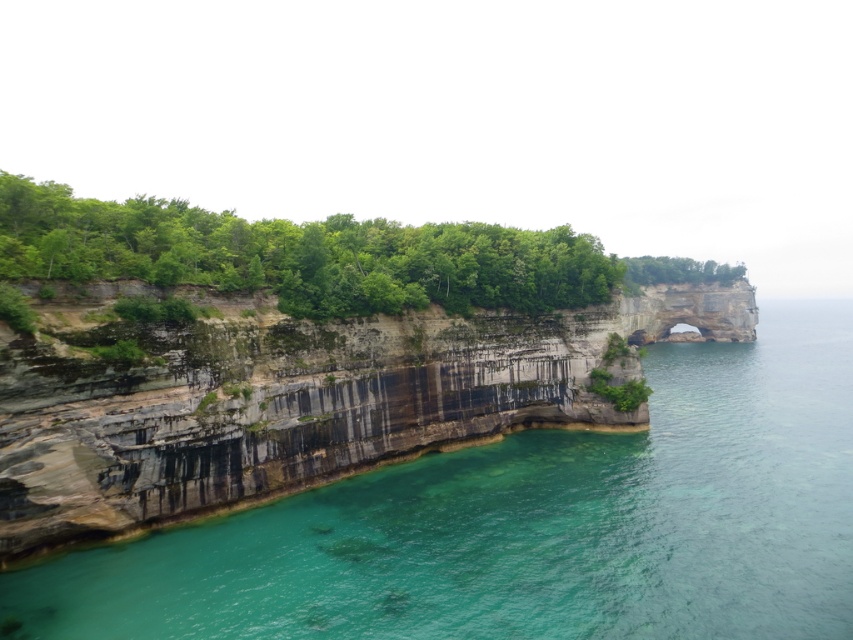
Does green leafy trees at upper center have a larger size compared to green leafy tree at upper center?

Indeed, green leafy trees at upper center has a larger size compared to green leafy tree at upper center.

I want to click on green leafy trees at upper center, so click(300, 253).

Who is taller, clear water at lower left or green leafy tree at upper center?

Standing taller between the two is green leafy tree at upper center.

Which is behind, point (245, 577) or point (730, 282)?

Positioned behind is point (730, 282).

In order to click on clear water at lower left in this screenshot , I will do `click(531, 525)`.

Who is higher up, clear water at lower left or green leafy trees at upper center?

green leafy trees at upper center is above.

The width and height of the screenshot is (853, 640). In order to click on clear water at lower left in this screenshot , I will do pyautogui.click(x=531, y=525).

What do you see at coordinates (531, 525) in the screenshot? I see `clear water at lower left` at bounding box center [531, 525].

Where is `clear water at lower left`? This screenshot has height=640, width=853. clear water at lower left is located at coordinates (531, 525).